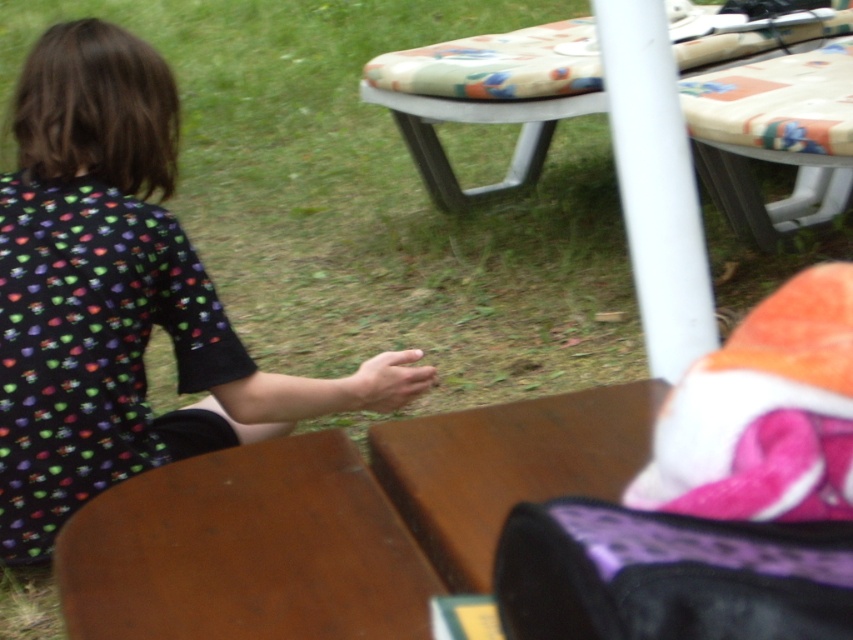
Find the location of `brown wooden table at center`. brown wooden table at center is located at coordinates (508, 467).

Describe the element at coordinates (508, 467) in the screenshot. I see `brown wooden table at center` at that location.

Identify the location of brown wooden table at center. This screenshot has width=853, height=640. (508, 467).

Between patterned fabric table at upper center and smooth skin hand at center, which one has less height?

smooth skin hand at center is shorter.

Can you confirm if patterned fabric table at upper center is positioned below smooth skin hand at center?

No, patterned fabric table at upper center is not below smooth skin hand at center.

Where is `patterned fabric table at upper center`? This screenshot has height=640, width=853. patterned fabric table at upper center is located at coordinates (488, 97).

Which of these two, brown wooden table at lower left or patterned fabric table at upper center, stands shorter?

brown wooden table at lower left is shorter.

Is point (143, 604) farther from viewer compared to point (525, 83)?

No, (143, 604) is closer to viewer.

Where is `brown wooden table at lower left`? This screenshot has width=853, height=640. brown wooden table at lower left is located at coordinates (247, 550).